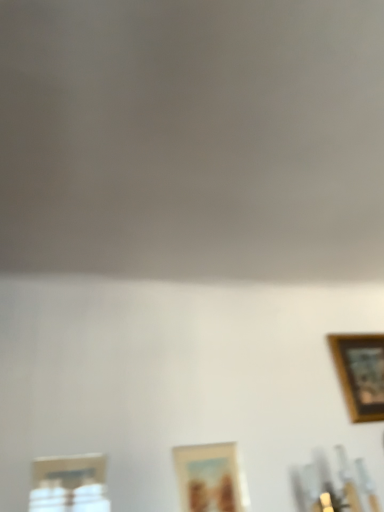
Question: Should I look upward or downward to see metallic silver picture frame at lower left, which is the third picture frame from right to left?

Choices:
 (A) down
 (B) up

Answer: (A)

Question: Should I look upward or downward to see wooden picture frame at lower center, which ranks as the second picture frame in right-to-left order?

Choices:
 (A) up
 (B) down

Answer: (B)

Question: Is wooden framed picture at upper right, which appears as the first picture frame when viewed from the back, turned away from metallic silver picture frame at lower left, placed as the 1th picture frame when sorted from left to right?

Choices:
 (A) no
 (B) yes

Answer: (A)

Question: Is wooden framed picture at upper right, marked as the 3th picture frame in a left-to-right arrangement, bigger than metallic silver picture frame at lower left, the 3th picture frame when ordered from back to front?

Choices:
 (A) no
 (B) yes

Answer: (B)

Question: Can you confirm if wooden framed picture at upper right, arranged as the third picture frame when viewed from the front, is taller than metallic silver picture frame at lower left, placed as the 1th picture frame when sorted from left to right?

Choices:
 (A) yes
 (B) no

Answer: (A)

Question: Considering the relative positions of wooden framed picture at upper right, marked as the 3th picture frame in a left-to-right arrangement, and metallic silver picture frame at lower left, the 3th picture frame when ordered from back to front, in the image provided, is wooden framed picture at upper right, marked as the 3th picture frame in a left-to-right arrangement, behind metallic silver picture frame at lower left, the 3th picture frame when ordered from back to front,?

Choices:
 (A) no
 (B) yes

Answer: (B)

Question: From a real-world perspective, does wooden framed picture at upper right, arranged as the third picture frame when viewed from the front, sit lower than metallic silver picture frame at lower left, which ranks as the first picture frame in front-to-back order?

Choices:
 (A) yes
 (B) no

Answer: (B)

Question: From a real-world perspective, is wooden framed picture at upper right, which is the first picture frame in right-to-left order, over metallic silver picture frame at lower left, which is the third picture frame from right to left?

Choices:
 (A) no
 (B) yes

Answer: (B)

Question: From a real-world perspective, is wooden picture frame at lower center, positioned as the 2th picture frame in front-to-back order, positioned over wooden framed picture at upper right, which appears as the first picture frame when viewed from the back, based on gravity?

Choices:
 (A) yes
 (B) no

Answer: (B)

Question: Can you confirm if wooden picture frame at lower center, which is the second picture frame from back to front, is shorter than wooden framed picture at upper right, which appears as the first picture frame when viewed from the back?

Choices:
 (A) yes
 (B) no

Answer: (A)

Question: Is wooden picture frame at lower center, the 2th picture frame when ordered from left to right, to the left of wooden framed picture at upper right, arranged as the third picture frame when viewed from the front, from the viewer's perspective?

Choices:
 (A) no
 (B) yes

Answer: (B)

Question: Is wooden picture frame at lower center, which ranks as the second picture frame in right-to-left order, positioned before wooden framed picture at upper right, which appears as the first picture frame when viewed from the back?

Choices:
 (A) no
 (B) yes

Answer: (B)

Question: Is wooden picture frame at lower center, positioned as the 2th picture frame in front-to-back order, turned away from wooden framed picture at upper right, which appears as the first picture frame when viewed from the back?

Choices:
 (A) no
 (B) yes

Answer: (A)

Question: From the image's perspective, does wooden picture frame at lower center, which ranks as the second picture frame in right-to-left order, appear higher than wooden framed picture at upper right, marked as the 3th picture frame in a left-to-right arrangement?

Choices:
 (A) yes
 (B) no

Answer: (B)

Question: Can you confirm if metallic silver picture frame at lower left, placed as the 1th picture frame when sorted from left to right, is positioned to the left of wooden picture frame at lower center, which is the second picture frame from back to front?

Choices:
 (A) yes
 (B) no

Answer: (A)